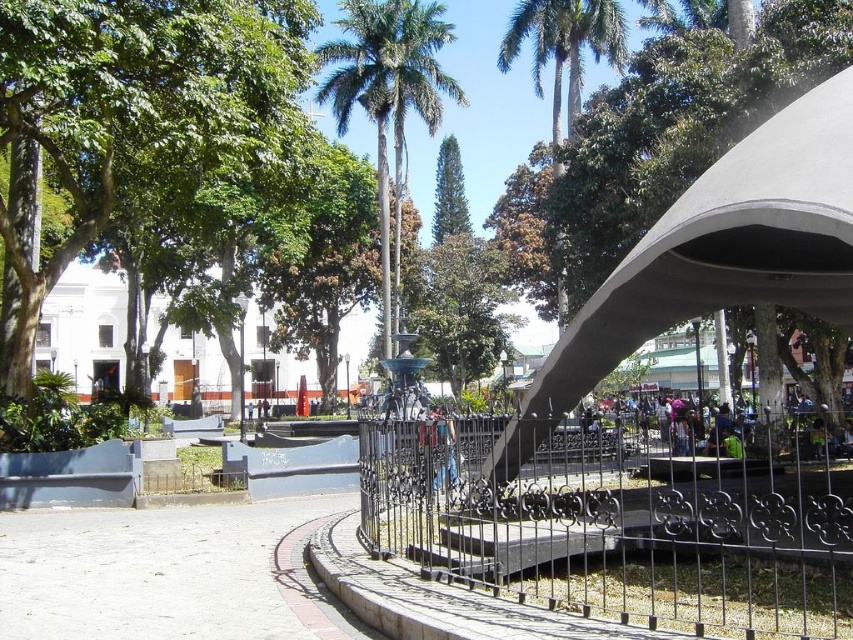
What do you see at coordinates (628, 516) in the screenshot? I see `black wrought iron fence at center` at bounding box center [628, 516].

Is black wrought iron fence at center below green leafy palm tree at upper center?

Yes.

Between point (822, 435) and point (576, 32), which one is positioned behind?

Point (576, 32)

Where is `black wrought iron fence at center`? This screenshot has height=640, width=853. black wrought iron fence at center is located at coordinates [x=628, y=516].

Which is more to the left, green leafy palm tree at center or metallic fence at center?

From the viewer's perspective, green leafy palm tree at center appears more on the left side.

Is green leafy palm tree at center to the right of metallic fence at center from the viewer's perspective?

No, green leafy palm tree at center is not to the right of metallic fence at center.

The width and height of the screenshot is (853, 640). Describe the element at coordinates (387, 93) in the screenshot. I see `green leafy palm tree at center` at that location.

This screenshot has height=640, width=853. I want to click on green leafy palm tree at center, so click(x=387, y=93).

Can you confirm if black wrought iron fence at center is shorter than metallic fence at center?

In fact, black wrought iron fence at center may be taller than metallic fence at center.

Locate an element on the screen. black wrought iron fence at center is located at coordinates (628, 516).